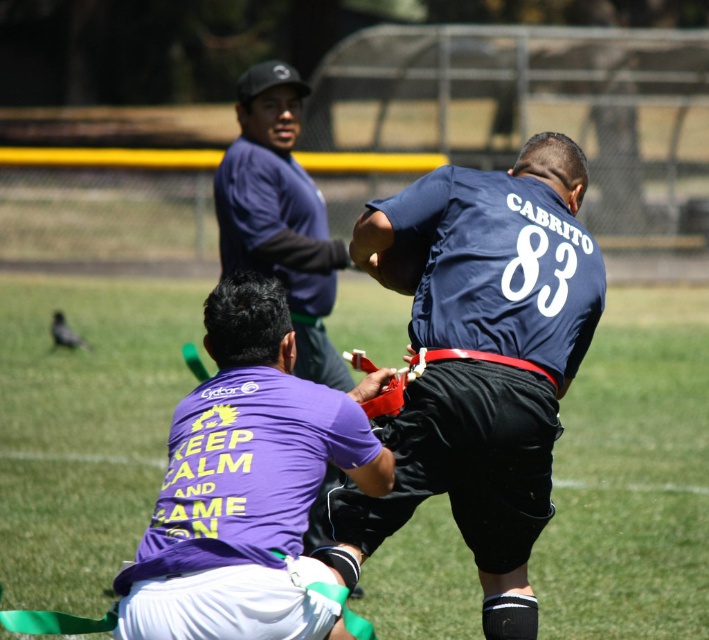
You are a sports equipment manager who needs to store the purple matte shirt at center and the matte blue jersey at upper center in a locker with a width of 1 meter. Based on their sizes, which jersey will require more space horizontally?

The purple matte shirt at center requires more horizontal space because its width is larger than the matte blue jersey at upper center.

You are a sports analyst watching the flag football game. You notice two players wearing the navy blue jersey at center and the matte blue jersey at upper center. Which player has a wider jersey?

The navy blue jersey at center has a greater width than the matte blue jersey at upper center, so the player wearing the navy blue jersey at center has a wider jersey.

What is the color of the fabric at the point with coordinates (84, 428)?

The point with coordinates (84, 428) is on the purple fabric shirt at center, so the color is purple.